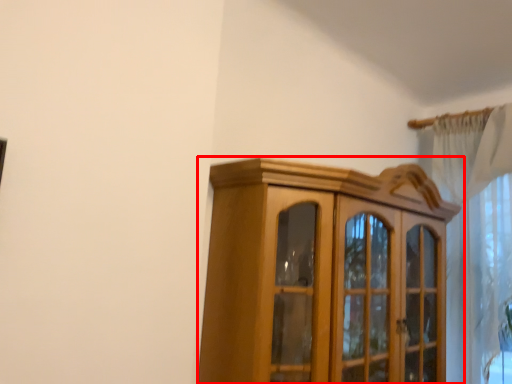
Question: Considering the relative positions of cupboard (annotated by the red box) and curtain in the image provided, where is cupboard (annotated by the red box) located with respect to the staircase?

Choices:
 (A) right
 (B) left

Answer: (B)